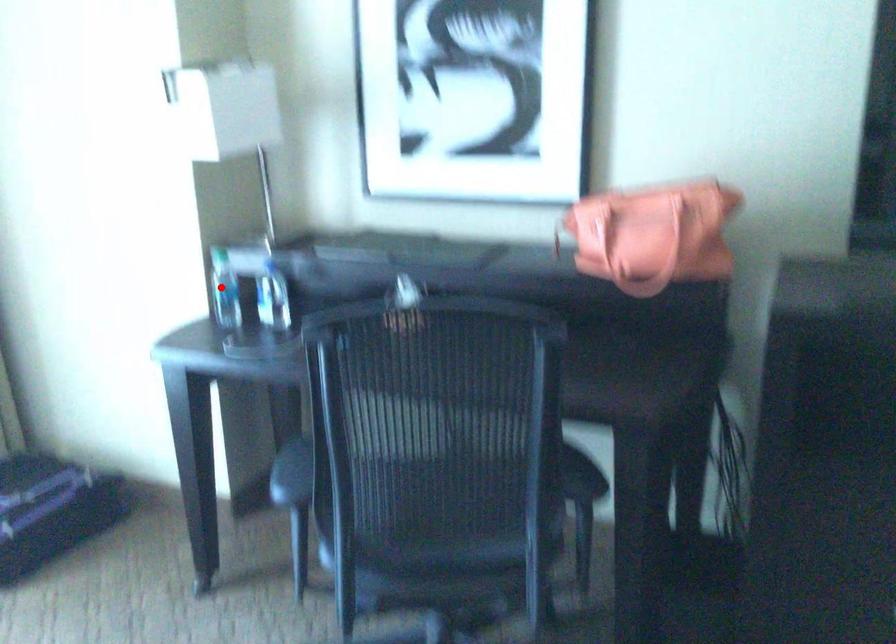
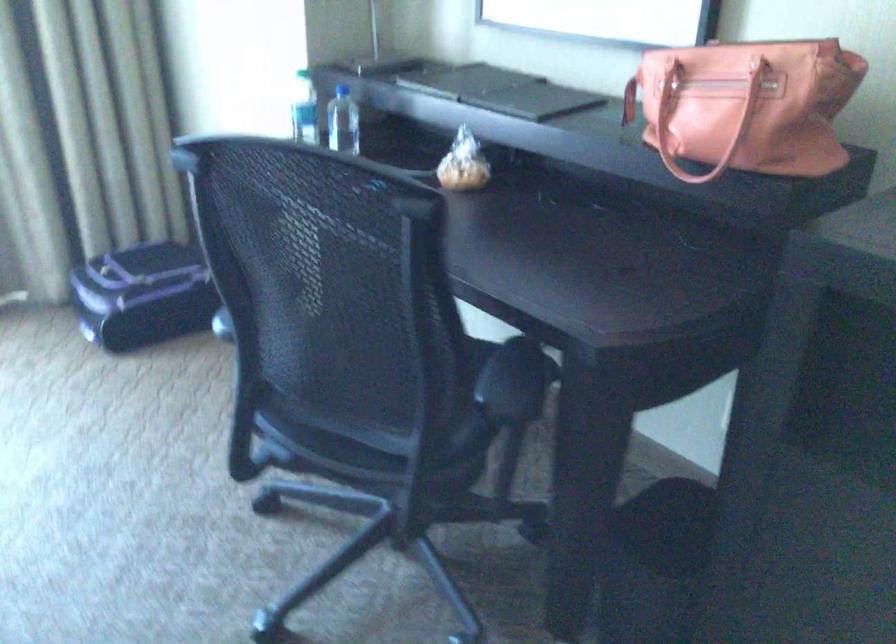
In the second image, find the point that corresponds to the highlighted location in the first image.

(304, 109)